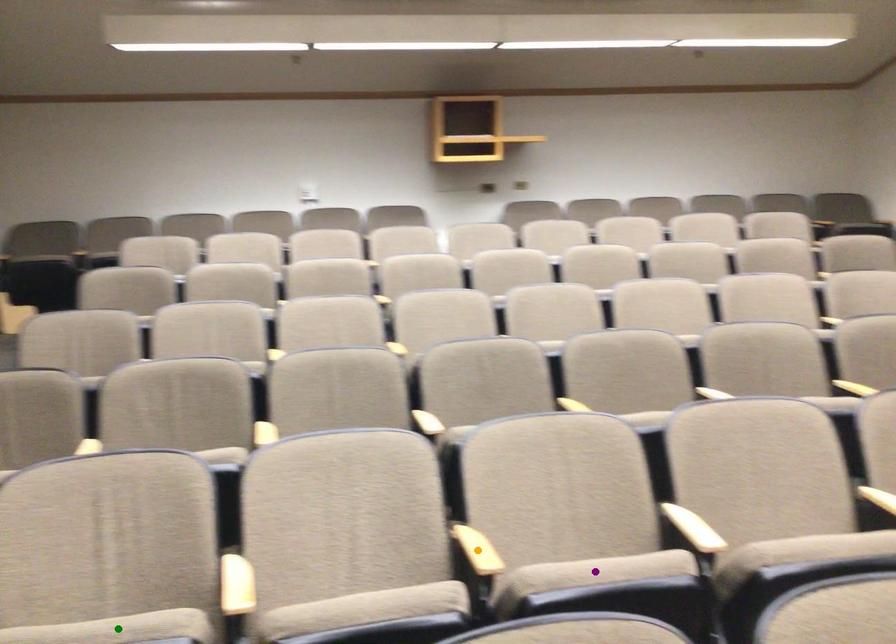
Based on the photo, order these from farthest to nearest:
green point
purple point
orange point

purple point, orange point, green point